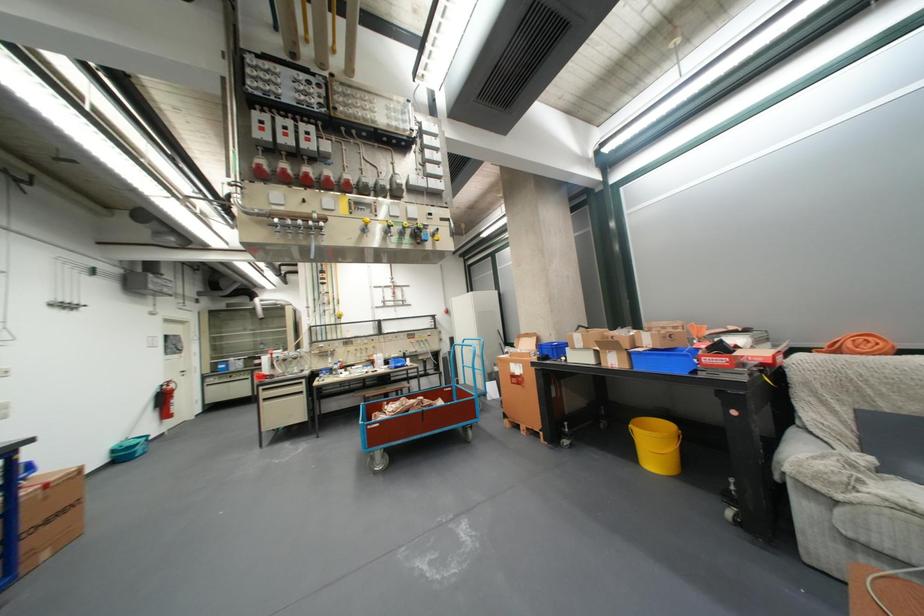
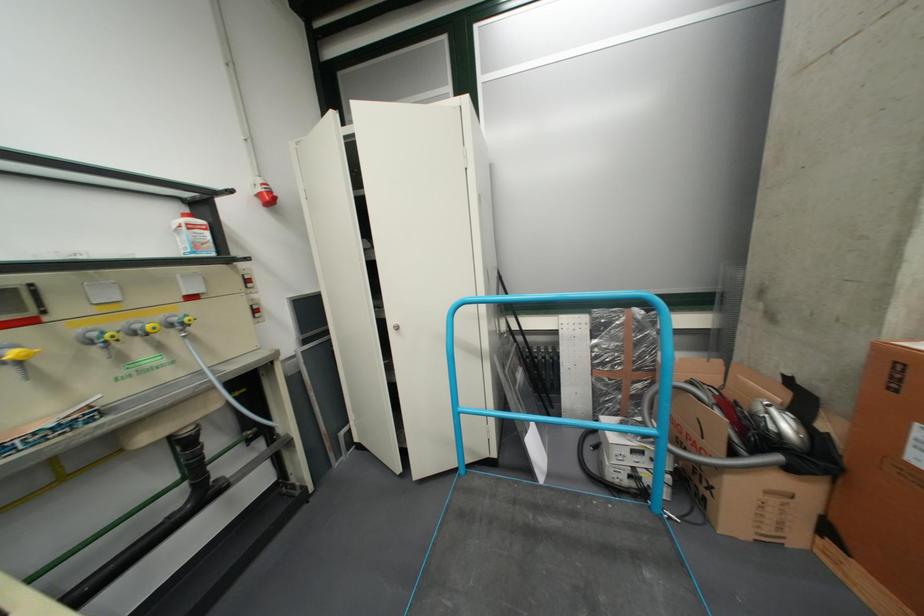
Where in the second image is the point corresponding to the point at 456,310 from the first image?

(260, 185)